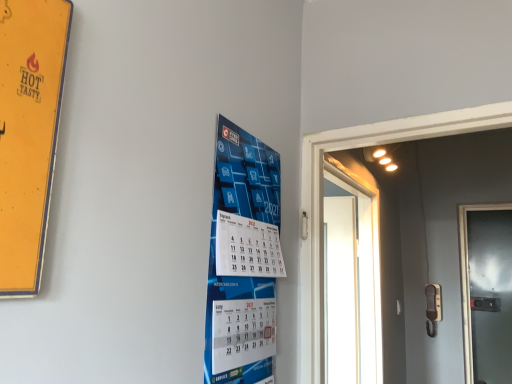
Question: Does blue paper calendar at center turn towards metallic glass door at right, the 1th door from the right?

Choices:
 (A) no
 (B) yes

Answer: (A)

Question: Considering the relative sizes of blue paper calendar at center and metallic glass door at right, the first door positioned from the back, in the image provided, is blue paper calendar at center bigger than metallic glass door at right, the first door positioned from the back,?

Choices:
 (A) yes
 (B) no

Answer: (B)

Question: Can you confirm if blue paper calendar at center is thinner than metallic glass door at right, which is the 2th door in left-to-right order?

Choices:
 (A) no
 (B) yes

Answer: (B)

Question: From a real-world perspective, does blue paper calendar at center stand above metallic glass door at right, the 1th door from the right?

Choices:
 (A) yes
 (B) no

Answer: (A)

Question: Can you confirm if blue paper calendar at center is positioned to the left of metallic glass door at right, the first door positioned from the back?

Choices:
 (A) no
 (B) yes

Answer: (B)

Question: From the image's perspective, is blue paper calendar at center located above metallic glass door at right, the 2th door viewed from the front?

Choices:
 (A) no
 (B) yes

Answer: (B)

Question: Is metallic glass door at right, the 1th door from the right, not near blue paper calendar at center?

Choices:
 (A) no
 (B) yes

Answer: (B)

Question: Is blue paper calendar at center located within metallic glass door at right, the 1th door from the right?

Choices:
 (A) no
 (B) yes

Answer: (A)

Question: Does metallic glass door at right, which is the 2th door in left-to-right order, have a larger size compared to blue paper calendar at center?

Choices:
 (A) no
 (B) yes

Answer: (B)

Question: Could you tell me if metallic glass door at right, which is the 2th door in left-to-right order, is facing blue paper calendar at center?

Choices:
 (A) yes
 (B) no

Answer: (B)

Question: Does metallic glass door at right, the 2th door viewed from the front, come in front of blue paper calendar at center?

Choices:
 (A) yes
 (B) no

Answer: (B)

Question: Considering the relative sizes of metallic glass door at right, the 1th door from the right, and blue paper calendar at center in the image provided, is metallic glass door at right, the 1th door from the right, taller than blue paper calendar at center?

Choices:
 (A) yes
 (B) no

Answer: (A)

Question: Does white glossy door at right, arranged as the 2th door when viewed from the back, turn towards metallic glass door at right, the 1th door from the right?

Choices:
 (A) yes
 (B) no

Answer: (B)